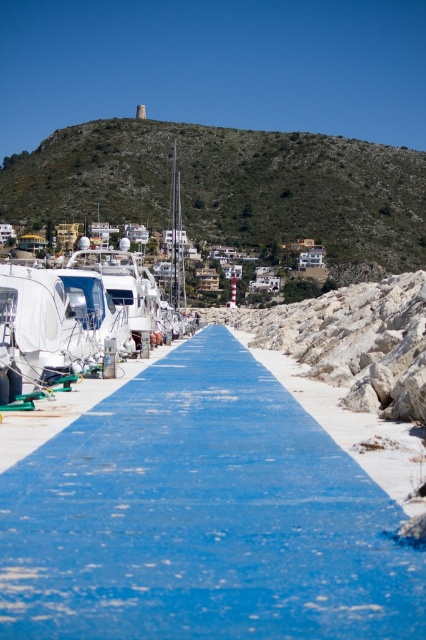
Question: Which of these objects is positioned farthest from the blue painted concrete at center?

Choices:
 (A) green textured hillside at upper center
 (B) white glossy boat at left

Answer: (A)

Question: Observing the image, what is the correct spatial positioning of blue painted concrete at center in reference to green textured hillside at upper center?

Choices:
 (A) right
 (B) left

Answer: (A)

Question: Is blue painted concrete at center bigger than green textured hillside at upper center?

Choices:
 (A) no
 (B) yes

Answer: (A)

Question: Is blue painted concrete at center thinner than white glossy boat at left?

Choices:
 (A) yes
 (B) no

Answer: (A)

Question: Estimate the real-world distances between objects in this image. Which object is closer to the white glossy boat at left?

Choices:
 (A) blue painted concrete at center
 (B) green textured hillside at upper center

Answer: (A)

Question: Which object is positioned farthest from the white glossy boat at left?

Choices:
 (A) green textured hillside at upper center
 (B) blue painted concrete at center

Answer: (A)